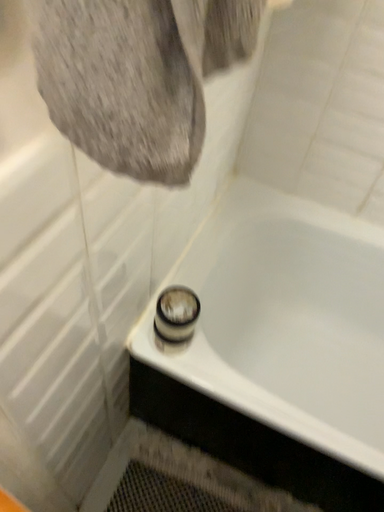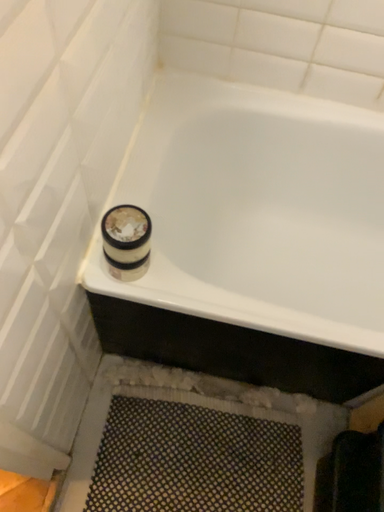
Question: How did the camera likely rotate when shooting the video?

Choices:
 (A) rotated upward
 (B) rotated downward

Answer: (B)